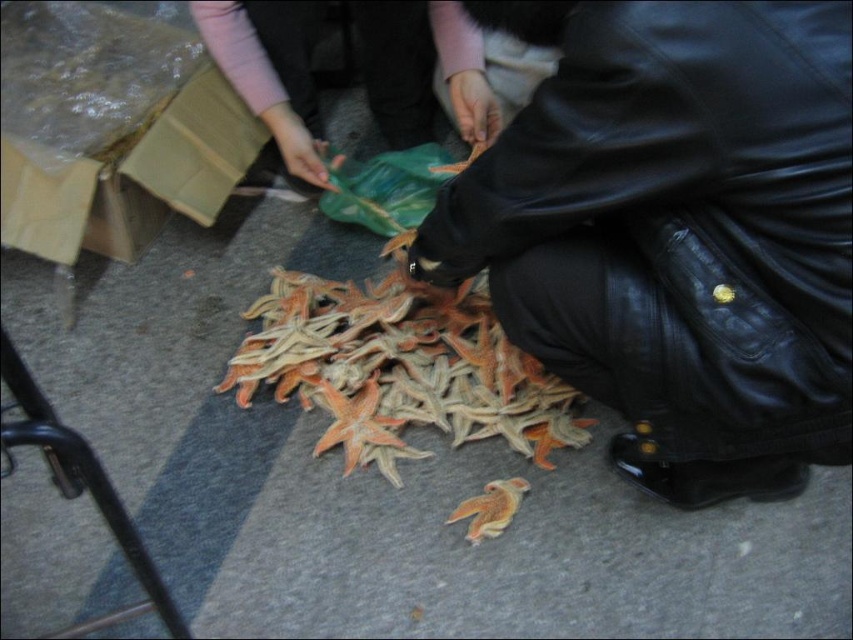
Question: Observing the image, what is the correct spatial positioning of leather jacket at lower right in reference to orange matte starfish at center?

Choices:
 (A) above
 (B) below

Answer: (A)

Question: Which point is closer to the camera?

Choices:
 (A) (524, 364)
 (B) (816, 419)

Answer: (B)

Question: Which object is closer to the camera taking this photo?

Choices:
 (A) orange matte starfish at center
 (B) leather jacket at lower right

Answer: (B)

Question: Among these objects, which one is farthest from the camera?

Choices:
 (A) leather jacket at lower right
 (B) orange matte starfish at center

Answer: (B)

Question: Observing the image, what is the correct spatial positioning of leather jacket at lower right in reference to orange matte starfish at center?

Choices:
 (A) left
 (B) right

Answer: (B)

Question: Is leather jacket at lower right behind orange matte starfish at center?

Choices:
 (A) no
 (B) yes

Answer: (A)